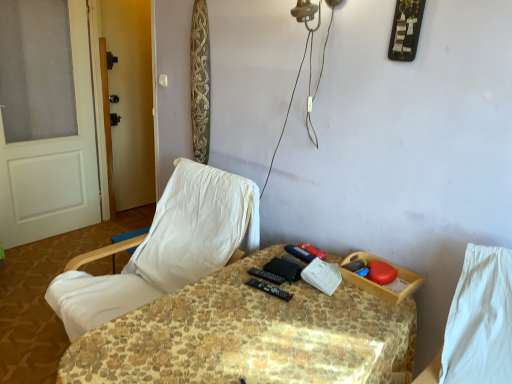
Question: Considering the relative positions of white fabric chair at left and white painted wood door at left in the image provided, is white fabric chair at left to the right of white painted wood door at left from the viewer's perspective?

Choices:
 (A) no
 (B) yes

Answer: (B)

Question: Can white painted wood door at left be found inside white fabric chair at left?

Choices:
 (A) yes
 (B) no

Answer: (B)

Question: Is white fabric chair at left positioned behind white painted wood door at left?

Choices:
 (A) yes
 (B) no

Answer: (B)

Question: From a real-world perspective, is white fabric chair at left located beneath white painted wood door at left?

Choices:
 (A) yes
 (B) no

Answer: (A)

Question: From the image's perspective, is white fabric chair at left located beneath white painted wood door at left?

Choices:
 (A) no
 (B) yes

Answer: (B)

Question: Does white fabric chair at left have a smaller size compared to white painted wood door at left?

Choices:
 (A) yes
 (B) no

Answer: (B)

Question: From a real-world perspective, does transparent glass screen door at left sit lower than white painted wood door at left?

Choices:
 (A) yes
 (B) no

Answer: (B)

Question: From the image's perspective, is transparent glass screen door at left located beneath white painted wood door at left?

Choices:
 (A) yes
 (B) no

Answer: (B)

Question: Is transparent glass screen door at left bigger than white painted wood door at left?

Choices:
 (A) yes
 (B) no

Answer: (A)

Question: From the image's perspective, would you say transparent glass screen door at left is positioned over white painted wood door at left?

Choices:
 (A) yes
 (B) no

Answer: (A)

Question: Is transparent glass screen door at left smaller than white painted wood door at left?

Choices:
 (A) yes
 (B) no

Answer: (B)

Question: Would you consider transparent glass screen door at left to be distant from white painted wood door at left?

Choices:
 (A) no
 (B) yes

Answer: (A)

Question: Does white fabric chair at left turn towards transparent glass screen door at left?

Choices:
 (A) yes
 (B) no

Answer: (B)